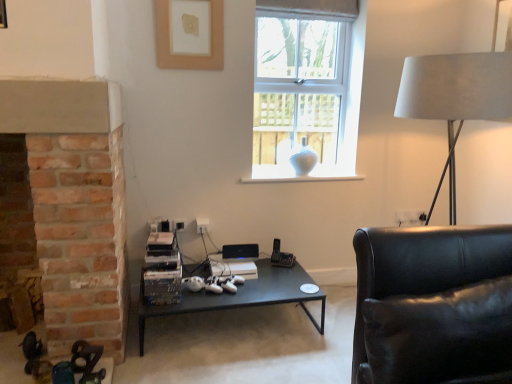
Question: In terms of width, does white glossy vase at center look wider or thinner when compared to black leather couch at right?

Choices:
 (A) wide
 (B) thin

Answer: (B)

Question: Visually, is white glossy vase at center positioned to the left or to the right of black leather couch at right?

Choices:
 (A) left
 (B) right

Answer: (A)

Question: Which object is positioned farthest from the matte white picture frame at upper center?

Choices:
 (A) black matte coffee table at center
 (B) black leather couch at right
 (C) white glossy vase at center
 (D) white fabric lampshade at right
 (E) white glass vase at upper center

Answer: (B)

Question: Based on their relative distances, which object is farther from the white glossy vase at center?

Choices:
 (A) black leather couch at right
 (B) white fabric lampshade at right
 (C) matte white picture frame at upper center
 (D) black matte coffee table at center
 (E) white glass vase at upper center

Answer: (A)